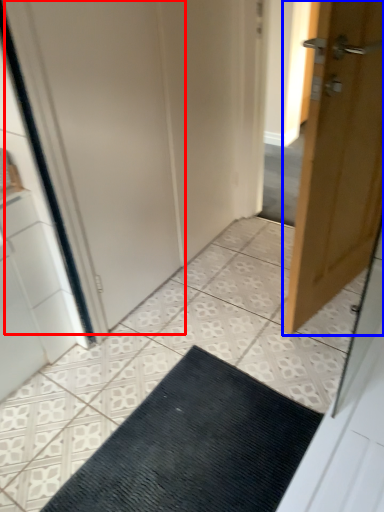
Question: Which of the following is the farthest to the observer, screen door (highlighted by a red box) or door (highlighted by a blue box)?

Choices:
 (A) screen door
 (B) door

Answer: (A)